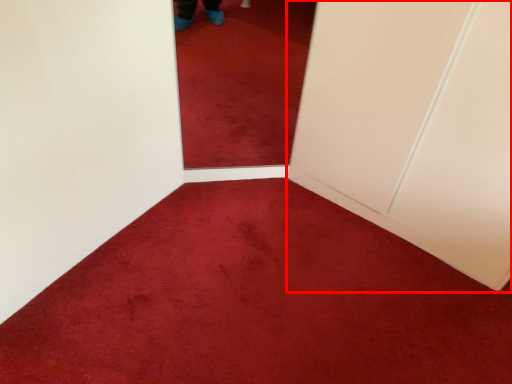
Question: From the image, what is the correct spatial relationship of door (annotated by the red box) in relation to plain?

Choices:
 (A) left
 (B) right

Answer: (B)